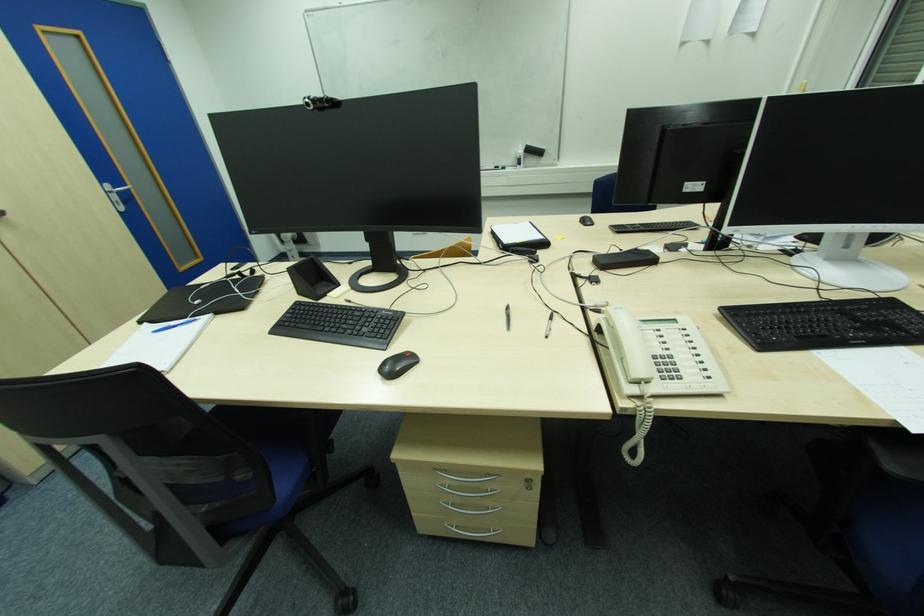
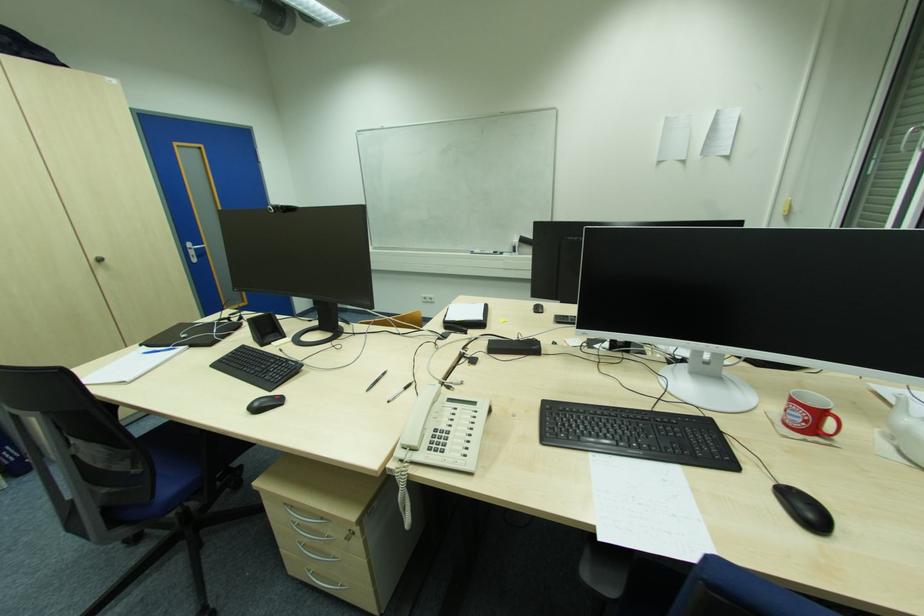
Question: The images are taken continuously from a first-person perspective. In which direction is your viewpoint rotating?

Choices:
 (A) Left
 (B) Right
 (C) Up
 (D) Down

Answer: (A)